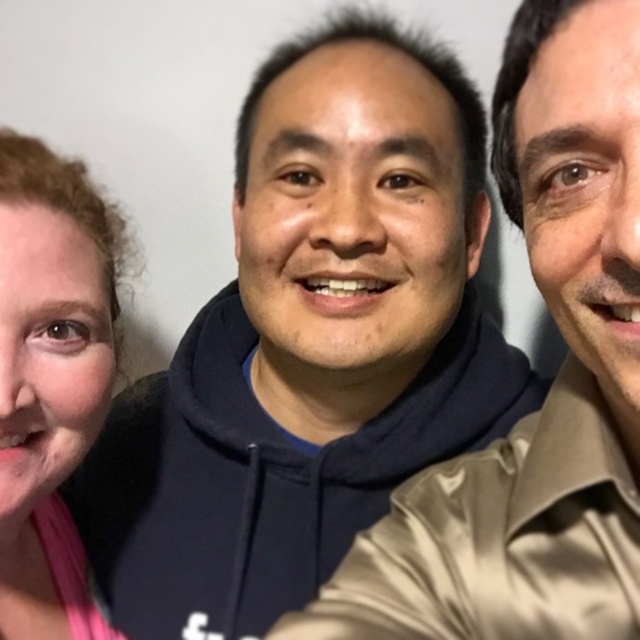
The height and width of the screenshot is (640, 640). Describe the element at coordinates (550, 388) in the screenshot. I see `dark blue hoodie at center` at that location.

Is dark blue hoodie at center positioned at the back of pink fabric at left?

No.

Does point (518, 106) come in front of point (72, 561)?

Yes, it is in front of point (72, 561).

You are a GUI agent. You are given a task and a screenshot of the screen. Output one action in this format:
    pyautogui.click(x=<x>, y=<y>)
    Task: Click on the dark blue hoodie at center
    
    Given the screenshot: What is the action you would take?
    (550, 388)